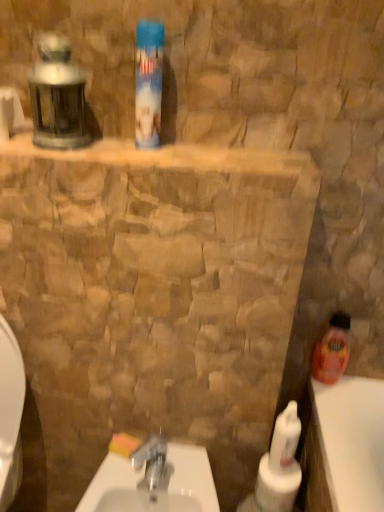
Question: In which direction should I rotate to look at blue plastic can at upper center, arranged as the 3th cleaning product when viewed from the back?

Choices:
 (A) right
 (B) left

Answer: (B)

Question: Is blue plastic can at upper center, which is counted as the 3th cleaning product, starting from the right, at the left side of white glossy sink at center?

Choices:
 (A) yes
 (B) no

Answer: (B)

Question: From the image's perspective, is blue plastic can at upper center, arranged as the 3th cleaning product when viewed from the back, beneath white glossy sink at center?

Choices:
 (A) yes
 (B) no

Answer: (B)

Question: From a real-world perspective, is blue plastic can at upper center, which ranks as the 1th cleaning product in front-to-back order, located beneath white glossy sink at center?

Choices:
 (A) no
 (B) yes

Answer: (A)

Question: Considering the relative positions of blue plastic can at upper center, which is counted as the 3th cleaning product, starting from the right, and white glossy sink at center in the image provided, is blue plastic can at upper center, which is counted as the 3th cleaning product, starting from the right, to the right of white glossy sink at center from the viewer's perspective?

Choices:
 (A) no
 (B) yes

Answer: (B)

Question: Is blue plastic can at upper center, the third cleaning product from the bottom, bigger than white glossy sink at center?

Choices:
 (A) yes
 (B) no

Answer: (B)

Question: Is blue plastic can at upper center, which is counted as the 3th cleaning product, starting from the right, placed right next to white glossy sink at center?

Choices:
 (A) no
 (B) yes

Answer: (A)

Question: Considering the relative sizes of blue plastic can at upper center, the first cleaning product from the left, and translucent plastic bottle at right, the 1th cleaning product in the back-to-front sequence, in the image provided, is blue plastic can at upper center, the first cleaning product from the left, bigger than translucent plastic bottle at right, the 1th cleaning product in the back-to-front sequence,?

Choices:
 (A) no
 (B) yes

Answer: (B)

Question: Can you confirm if blue plastic can at upper center, the 1th cleaning product from the top, is smaller than translucent plastic bottle at right, the 3th cleaning product viewed from the front?

Choices:
 (A) no
 (B) yes

Answer: (A)

Question: Considering the relative sizes of blue plastic can at upper center, which is counted as the 3th cleaning product, starting from the right, and translucent plastic bottle at right, which ranks as the third cleaning product in left-to-right order, in the image provided, is blue plastic can at upper center, which is counted as the 3th cleaning product, starting from the right, wider than translucent plastic bottle at right, which ranks as the third cleaning product in left-to-right order,?

Choices:
 (A) no
 (B) yes

Answer: (B)

Question: From a real-world perspective, is blue plastic can at upper center, which is counted as the 3th cleaning product, starting from the right, positioned under translucent plastic bottle at right, the 3th cleaning product viewed from the front, based on gravity?

Choices:
 (A) yes
 (B) no

Answer: (B)

Question: Does blue plastic can at upper center, the 1th cleaning product from the top, appear on the left side of translucent plastic bottle at right, placed as the 2th cleaning product when sorted from bottom to top?

Choices:
 (A) no
 (B) yes

Answer: (B)

Question: Can you confirm if blue plastic can at upper center, arranged as the 3th cleaning product when viewed from the back, is shorter than translucent plastic bottle at right, the 1th cleaning product in the back-to-front sequence?

Choices:
 (A) yes
 (B) no

Answer: (B)

Question: Is white glossy sink at center completely or partially outside of white glossy bottle at lower right, which is the 1th cleaning product in bottom-to-top order?

Choices:
 (A) yes
 (B) no

Answer: (A)